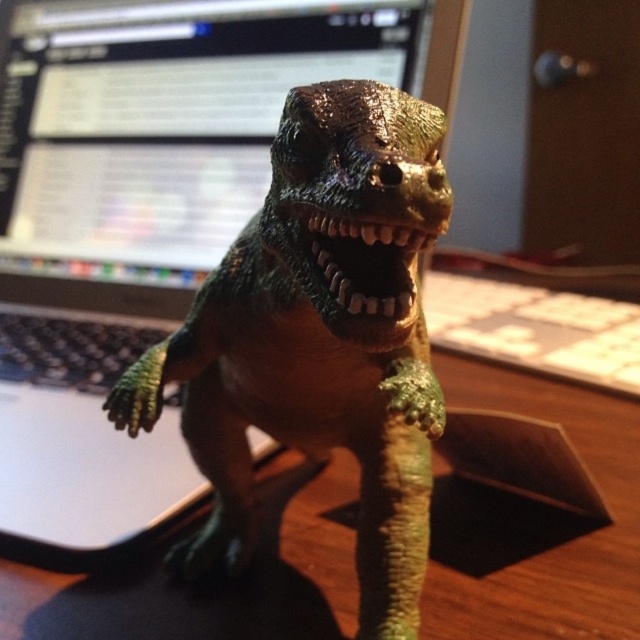
You are organizing a desk and want to place the shiny plastic dinosaur at center and the matte black monitor at upper center. Considering their sizes, which object should you adjust to avoid blocking the keyboard area?

The shiny plastic dinosaur at center is taller than the matte black monitor at upper center, so you should adjust the position of the shiny plastic dinosaur at center to avoid blocking the keyboard area.

You are setting up a workspace and want to place a new keyboard between the wooden desk at center and the matte black monitor at upper center. The keyboard requires a minimum of 24 inches of space. Based on the image, is there enough space to place the keyboard between them?

The distance between the wooden desk at center and the matte black monitor at upper center is 31.42 inches, which is more than the required 24 inches. Therefore, there is sufficient space to place the keyboard between them.

You are organizing your desk and need to move the shiny plastic dinosaur at center and the wooden desk at center. Since both are at the center, can you tell which one is more to the left?

The shiny plastic dinosaur at center is positioned on the left side of wooden desk at center, so it is more to the left.